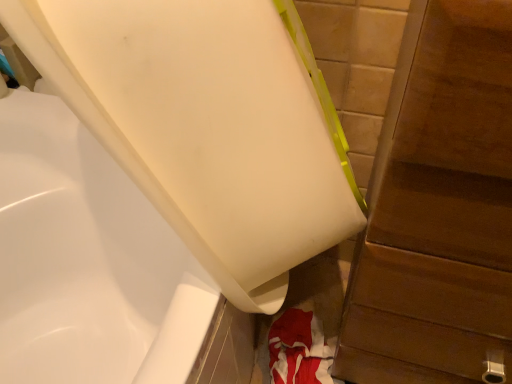
Question: Is wooden dresser at right in contact with white glossy bathtub at lower left?

Choices:
 (A) yes
 (B) no

Answer: (B)

Question: Would you say wooden dresser at right contains white glossy bathtub at lower left?

Choices:
 (A) no
 (B) yes

Answer: (A)

Question: From the image's perspective, is wooden dresser at right beneath white glossy bathtub at lower left?

Choices:
 (A) yes
 (B) no

Answer: (A)

Question: Is wooden dresser at right in front of white glossy bathtub at lower left?

Choices:
 (A) yes
 (B) no

Answer: (A)

Question: Does wooden dresser at right have a smaller size compared to white glossy bathtub at lower left?

Choices:
 (A) no
 (B) yes

Answer: (A)

Question: Does wooden dresser at right turn towards white glossy bathtub at lower left?

Choices:
 (A) yes
 (B) no

Answer: (B)

Question: Is white glossy bathtub at lower left positioned far away from wooden dresser at right?

Choices:
 (A) yes
 (B) no

Answer: (B)

Question: Can you confirm if white glossy bathtub at lower left is smaller than wooden dresser at right?

Choices:
 (A) yes
 (B) no

Answer: (A)

Question: Is white glossy bathtub at lower left facing towards wooden dresser at right?

Choices:
 (A) yes
 (B) no

Answer: (B)

Question: Does white glossy bathtub at lower left have a lesser height compared to wooden dresser at right?

Choices:
 (A) yes
 (B) no

Answer: (A)

Question: Can you confirm if white glossy bathtub at lower left is wider than wooden dresser at right?

Choices:
 (A) yes
 (B) no

Answer: (A)

Question: From the image's perspective, does white glossy bathtub at lower left appear lower than wooden dresser at right?

Choices:
 (A) no
 (B) yes

Answer: (A)

Question: Is white glossy bathtub at lower left bigger or smaller than wooden dresser at right?

Choices:
 (A) big
 (B) small

Answer: (B)